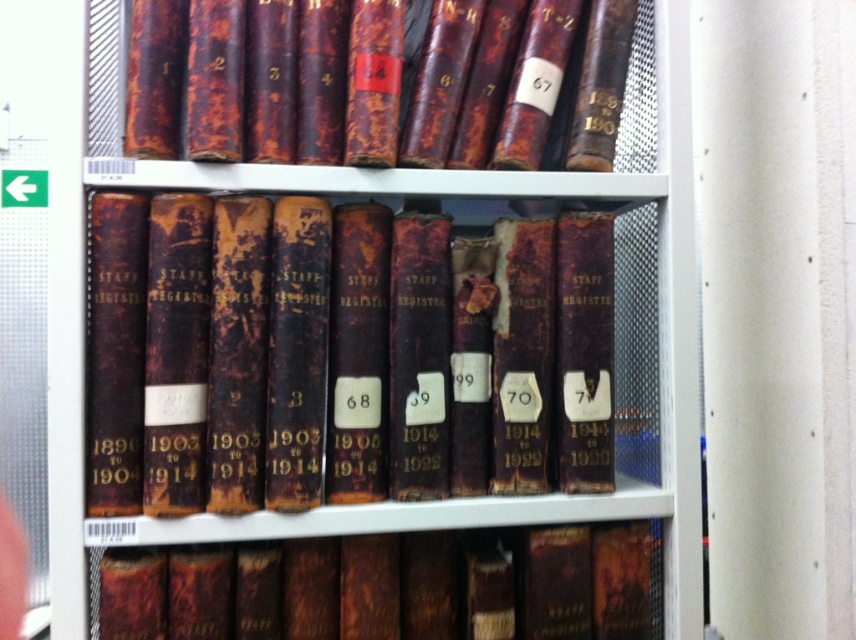
You are organizing the staff registers and notice two books on the shelf. Which one is positioned to the left between the dark brown leather book at center and the rusty leather book at center?

The dark brown leather book at center is positioned to the left of the rusty leather book at center.

Looking at this image, you are an archivist organizing the STAFF REGISTERS books on a shelf. You notice a point marked at coordinates (379, 83). Which book is this point located on?

The point marked at coordinates (379, 83) is located on the rusty leather book at upper center.